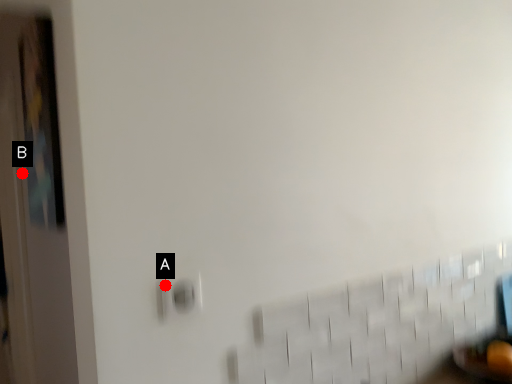
Question: Two points are circled on the image, labeled by A and B beside each circle. Which point is further to the camera?

Choices:
 (A) A is further
 (B) B is further

Answer: (B)